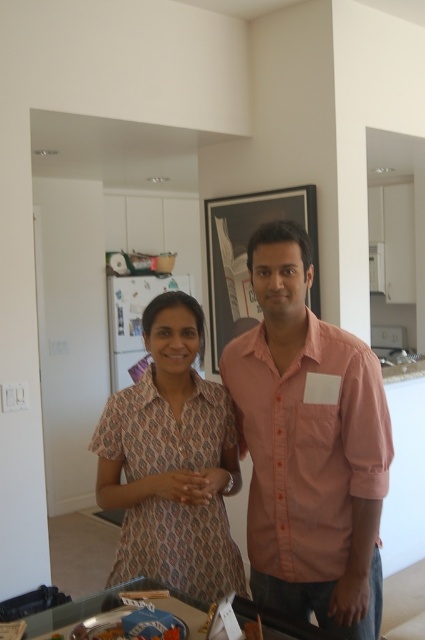
Who is positioned more to the left, pink cotton shirt at center or dull pink printed blouse at center?

From the viewer's perspective, dull pink printed blouse at center appears more on the left side.

Is point (314, 372) less distant than point (210, 497)?

No, it is behind (210, 497).

Between point (286, 385) and point (129, 449), which one is positioned in front?

Point (286, 385) is more forward.

I want to click on pink cotton shirt at center, so click(x=308, y=445).